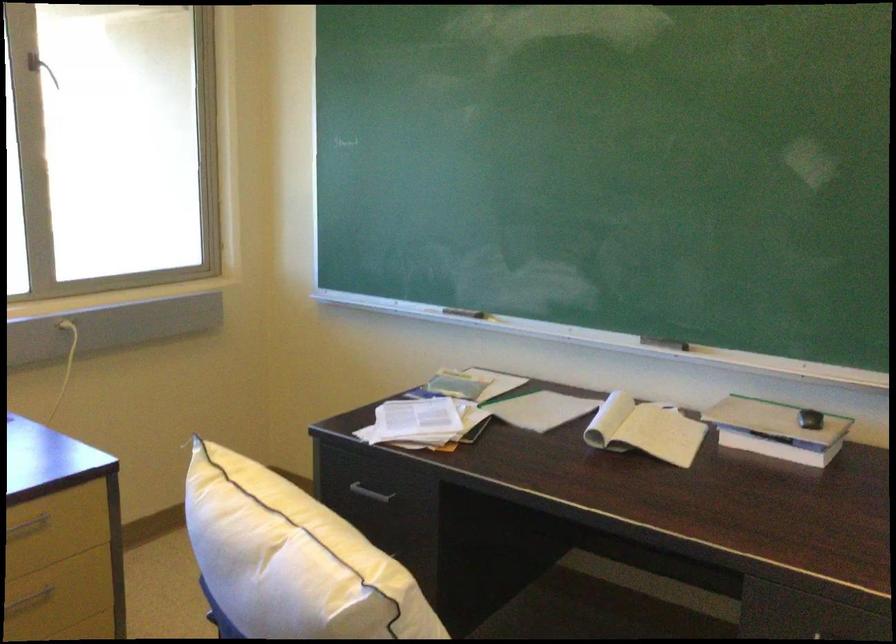
Find where to lift the white pillow. Please return your answer as a coordinate pair (x, y).

(291, 559)